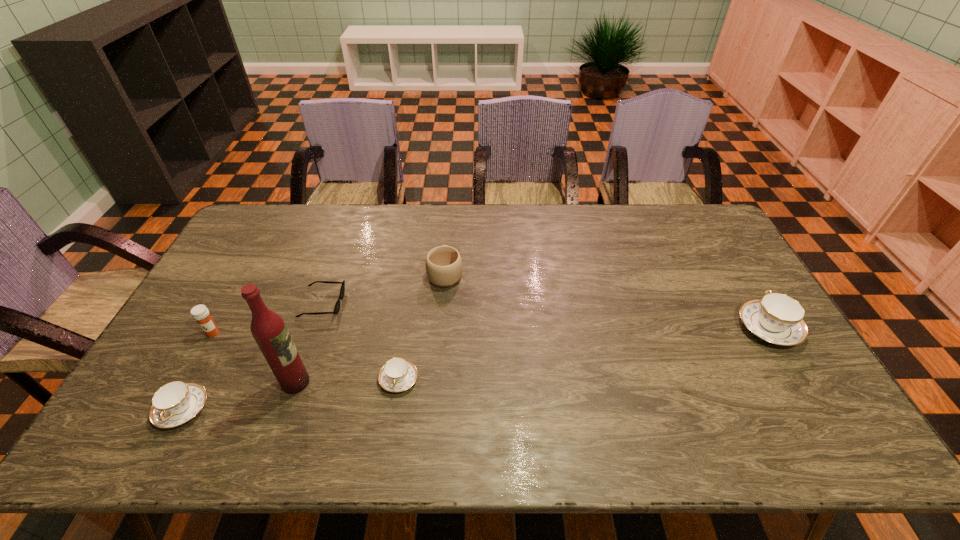
To achieve even spacing by inserting another teacup among them, please point to a vacant spot for this new teacup. Please provide its 2D coordinates. Your answer should be formatted as a tuple, i.e. [(x, y)], where the tuple contains the x and y coordinates of a point satisfying the conditions above.

[(593, 352)]